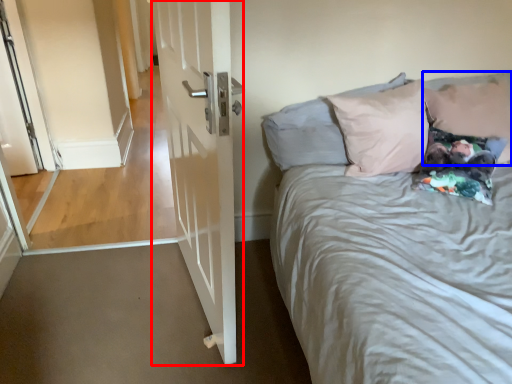
Question: Which object is closer to the camera taking this photo, door (highlighted by a red box) or pillow (highlighted by a blue box)?

Choices:
 (A) door
 (B) pillow

Answer: (A)